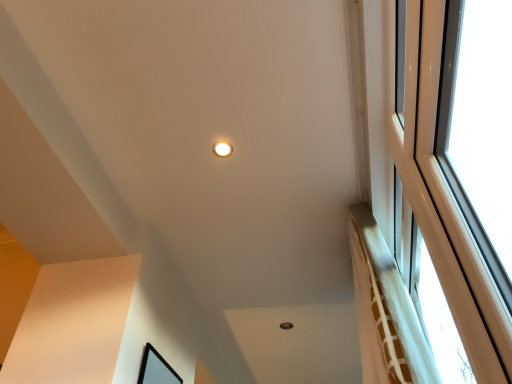
Question: Would you say matte white light fixture at upper center is inside or outside black matte picture frame at lower left?

Choices:
 (A) inside
 (B) outside

Answer: (B)

Question: Is matte white light fixture at upper center in front of or behind black matte picture frame at lower left in the image?

Choices:
 (A) behind
 (B) front

Answer: (A)

Question: Is matte white light fixture at upper center wider or thinner than black matte picture frame at lower left?

Choices:
 (A) wide
 (B) thin

Answer: (A)

Question: In the image, is black matte picture frame at lower left on the left side or the right side of matte white light fixture at upper center?

Choices:
 (A) right
 (B) left

Answer: (B)

Question: Which is correct: black matte picture frame at lower left is inside matte white light fixture at upper center, or outside of it?

Choices:
 (A) outside
 (B) inside

Answer: (A)

Question: In terms of height, does black matte picture frame at lower left look taller or shorter compared to matte white light fixture at upper center?

Choices:
 (A) tall
 (B) short

Answer: (A)

Question: From a real-world perspective, is black matte picture frame at lower left positioned above or below matte white light fixture at upper center?

Choices:
 (A) above
 (B) below

Answer: (B)